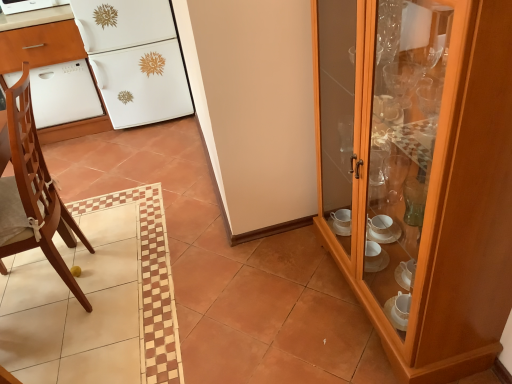
What are the coordinates of `blank space to the left of wooden cabinet at right` in the screenshot? It's located at (270, 301).